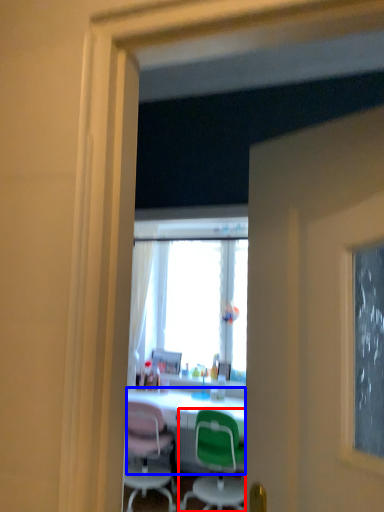
Question: Which point is closer to the camera, chair (highlighted by a red box) or desk (highlighted by a blue box)?

Choices:
 (A) chair
 (B) desk

Answer: (A)